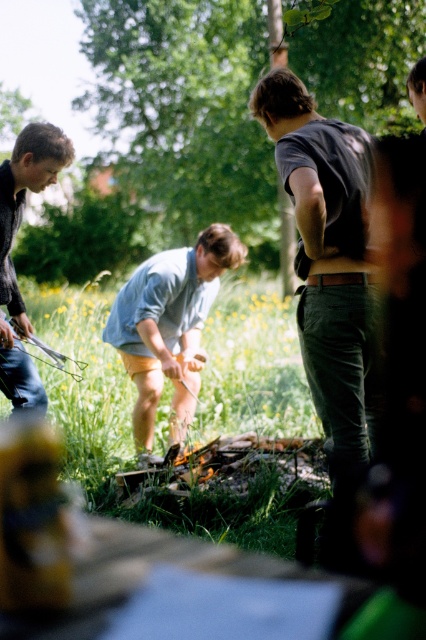
You are standing in the park and want to sit down on the green grass at center. However, you are wearing the light blue denim shorts at center. Will your shorts get dirty from the grass?

The green grass at center has a greater height compared to light blue denim shorts at center, so the grass may brush against the shorts, potentially causing them to get dirty depending on how you sit.